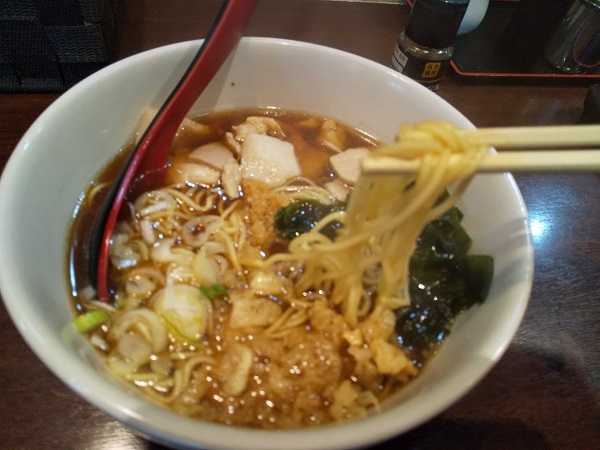
This screenshot has width=600, height=450. I want to click on spoon, so click(x=140, y=174).